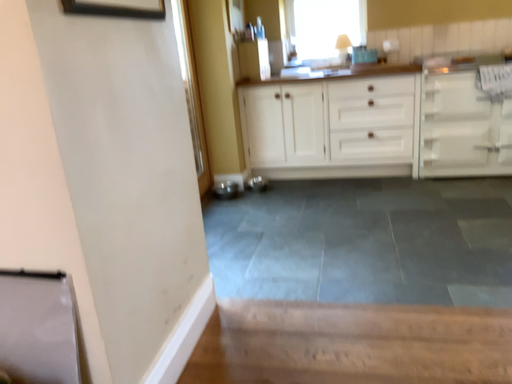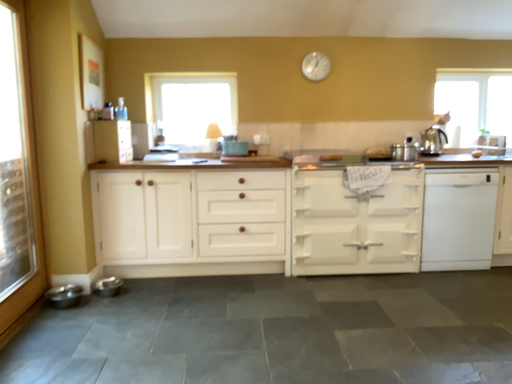
Question: Which way did the camera rotate in the video?

Choices:
 (A) rotated left
 (B) rotated right

Answer: (B)